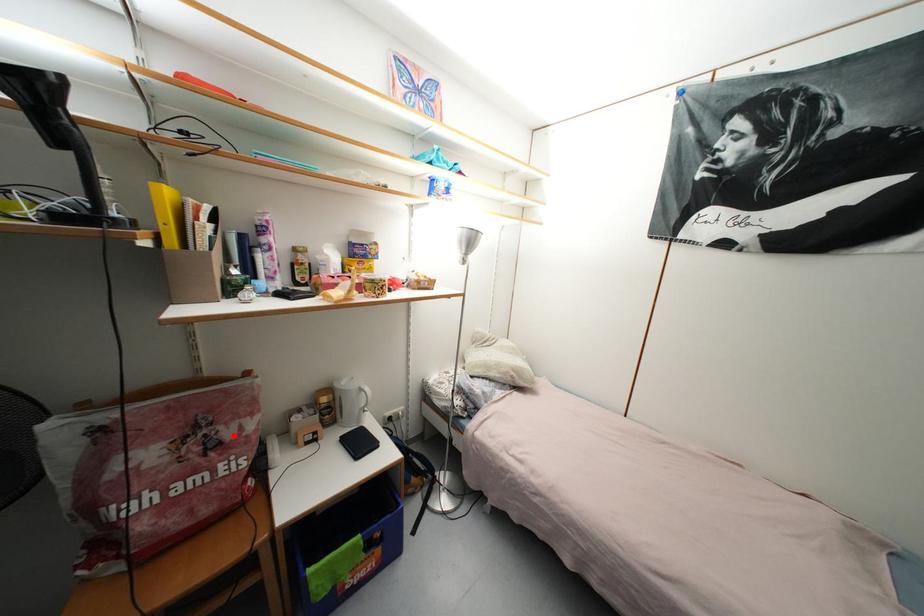
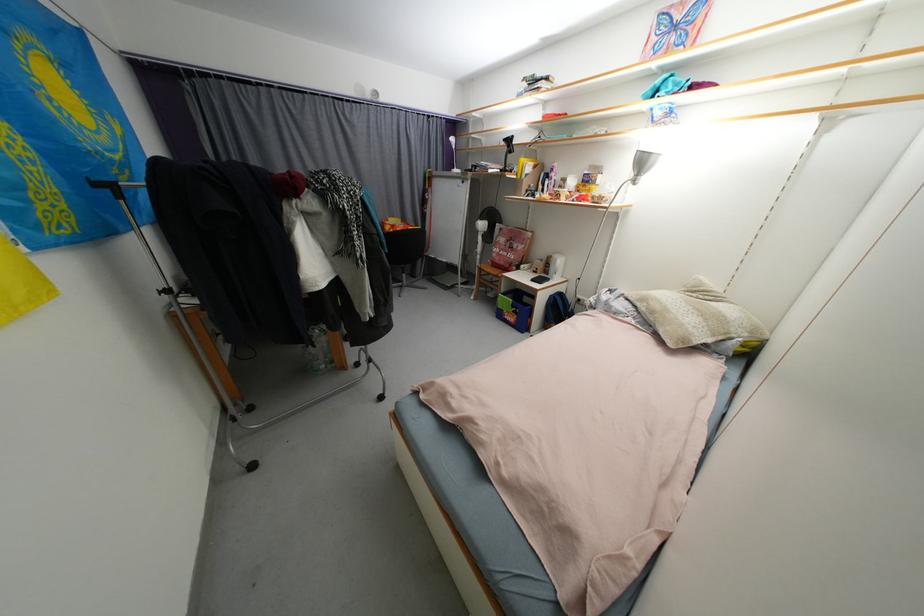
Question: I am providing you with two images of the same scene from different viewpoints. Given a red point in image1, look at the same physical point in image2. Is it:

Choices:
 (A) Closer to the viewpoint
 (B) Farther from the viewpoint

Answer: (A)